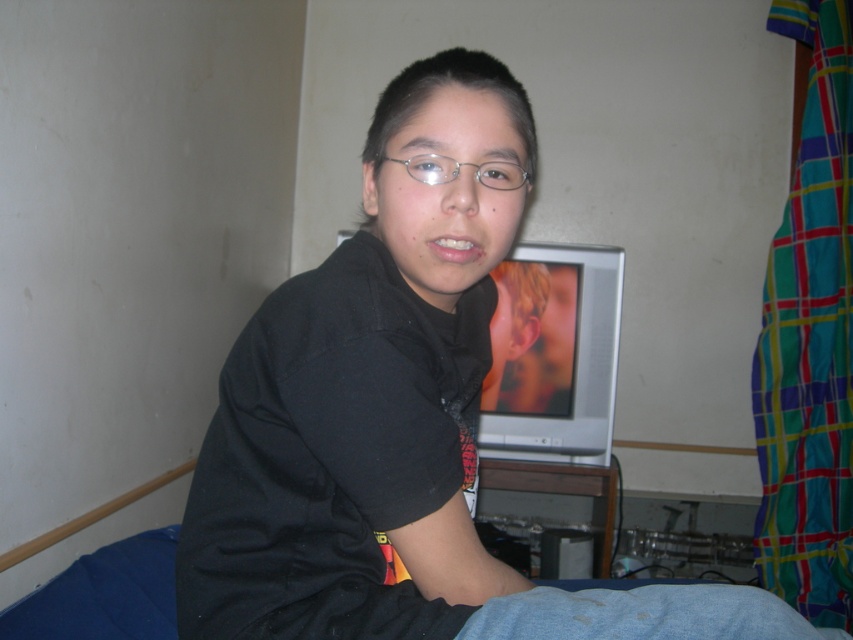
Is black matte shirt at center wider than clear plastic glasses at center?

Correct, the width of black matte shirt at center exceeds that of clear plastic glasses at center.

Which is in front, point (503, 97) or point (515, 179)?

Point (515, 179) is in front.

The height and width of the screenshot is (640, 853). Identify the location of black matte shirt at center. (396, 419).